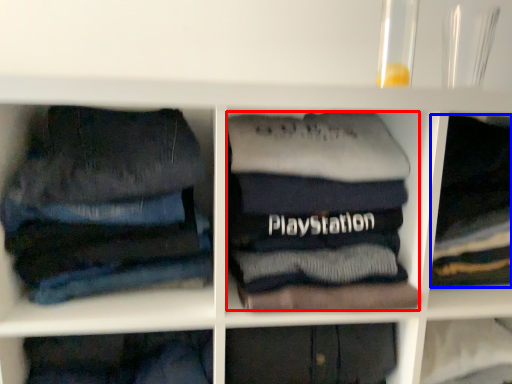
Question: Among these objects, which one is nearest to the camera, clothing (highlighted by a red box) or clothing (highlighted by a blue box)?

Choices:
 (A) clothing
 (B) clothing

Answer: (A)